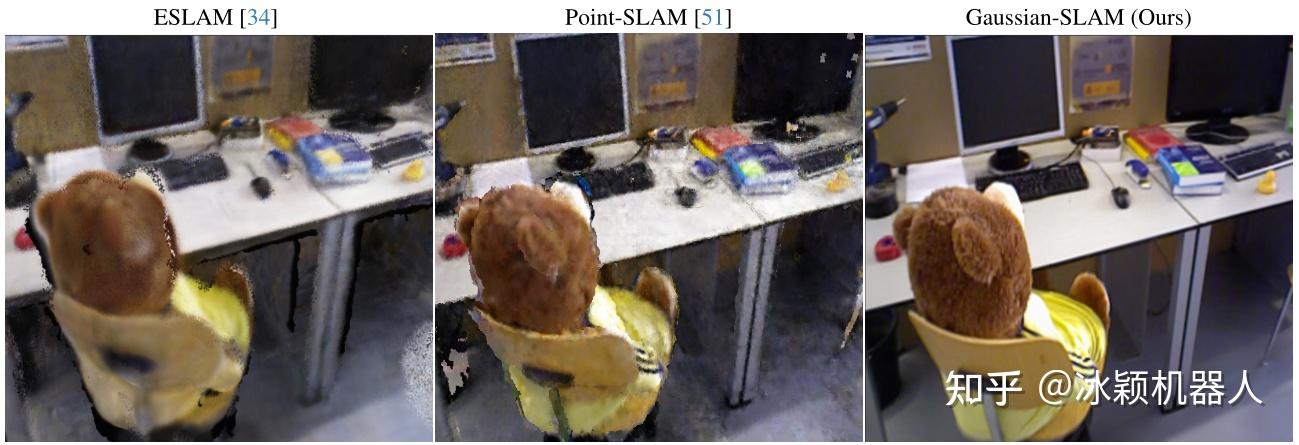
I want to click on white desk, so pos(240,215).